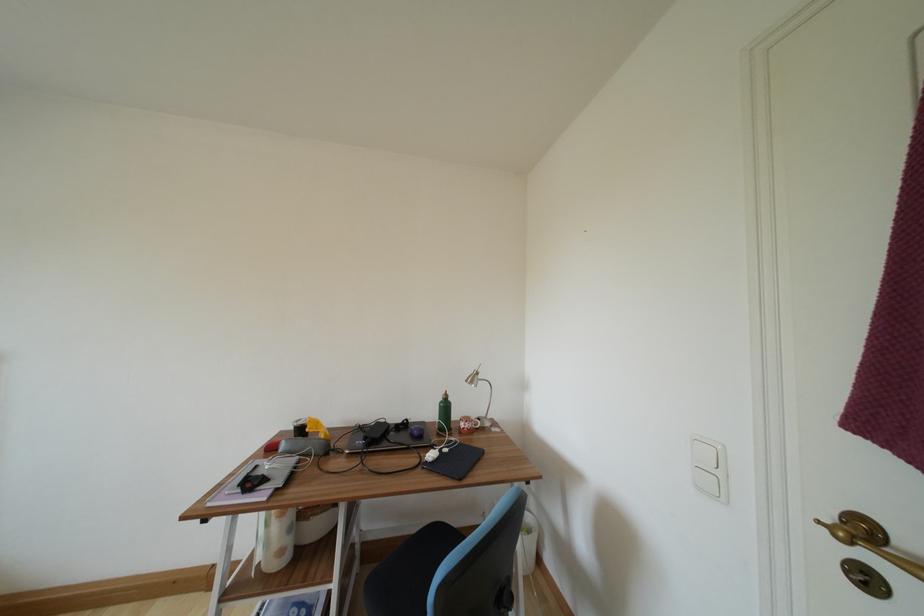
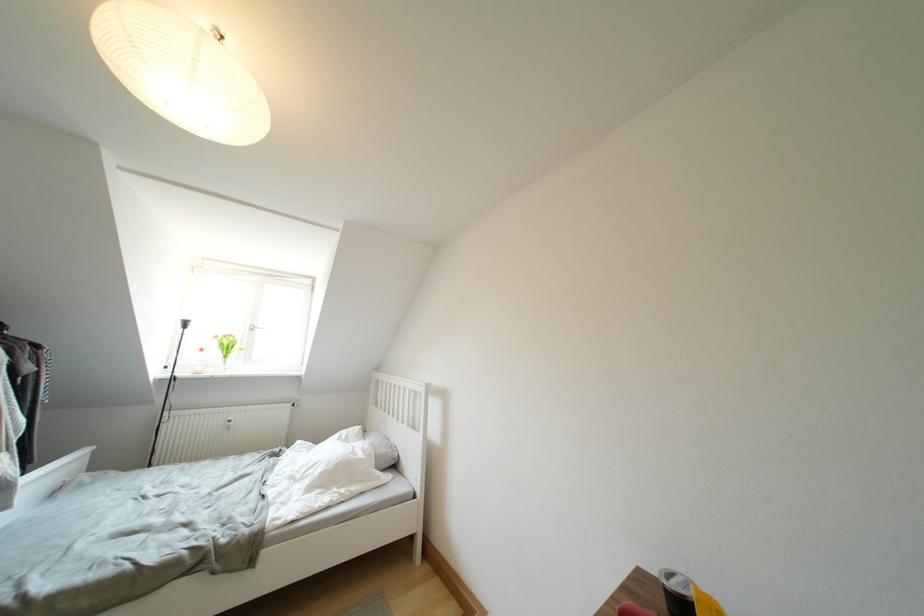
Question: How did the camera likely rotate?

Choices:
 (A) Left
 (B) Right
 (C) Up
 (D) Down

Answer: (A)